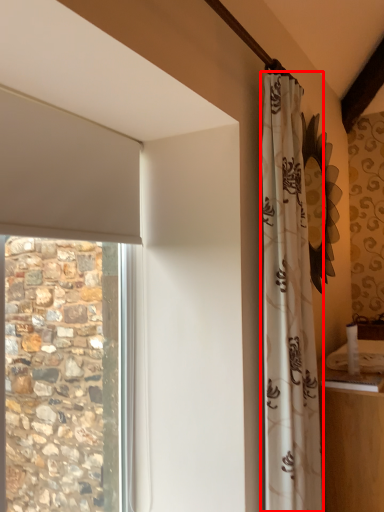
Question: From the image's perspective, considering the relative positions of curtain (annotated by the red box) and counter top in the image provided, where is curtain (annotated by the red box) located with respect to the staircase?

Choices:
 (A) above
 (B) below

Answer: (A)